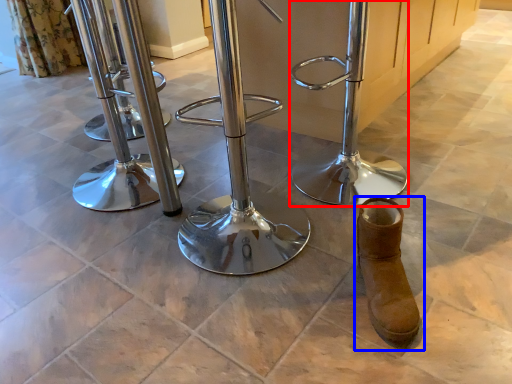
Question: Which object appears closest to the camera in this image, swivel chair (highlighted by a red box) or footwear (highlighted by a blue box)?

Choices:
 (A) swivel chair
 (B) footwear

Answer: (B)